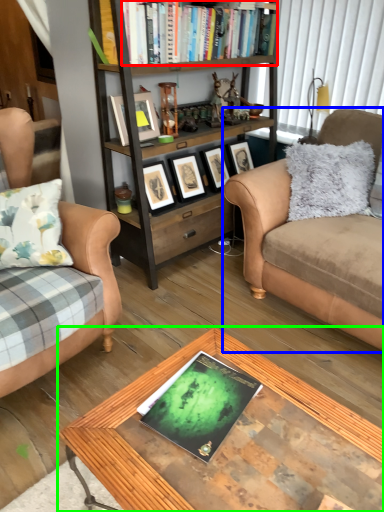
Question: Which object is the farthest from book (highlighted by a red box)? Choose among these: studio couch (highlighted by a blue box) or coffee table (highlighted by a green box).

Choices:
 (A) studio couch
 (B) coffee table

Answer: (B)